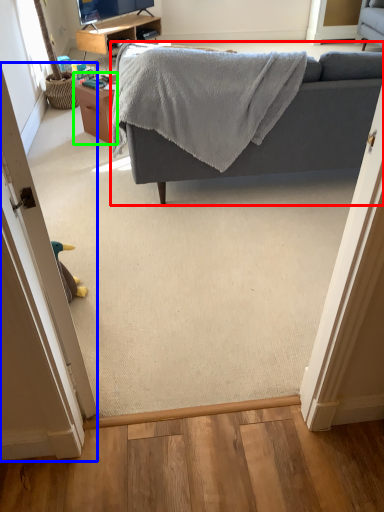
Question: Which object is positioned closest to studio couch (highlighted by a red box)? Select from door (highlighted by a blue box) and table (highlighted by a green box).

Choices:
 (A) door
 (B) table

Answer: (B)